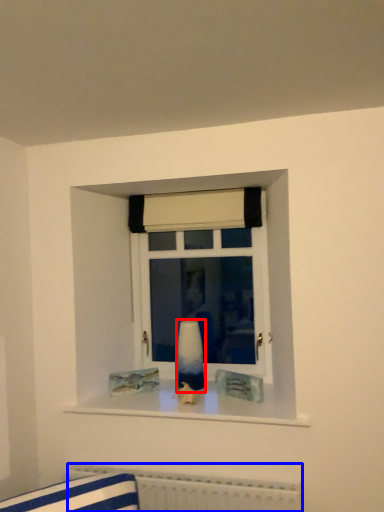
Question: Which point is closer to the camera, vase (highlighted by a red box) or radiator (highlighted by a blue box)?

Choices:
 (A) vase
 (B) radiator

Answer: (B)